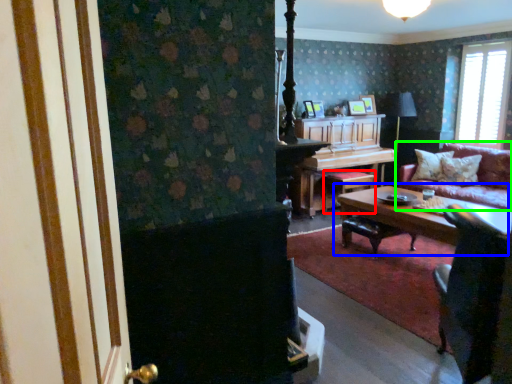
Question: Which object is the farthest from stool (highlighted by a red box)? Choose among these: coffee table (highlighted by a blue box) or studio couch (highlighted by a green box).

Choices:
 (A) coffee table
 (B) studio couch

Answer: (B)